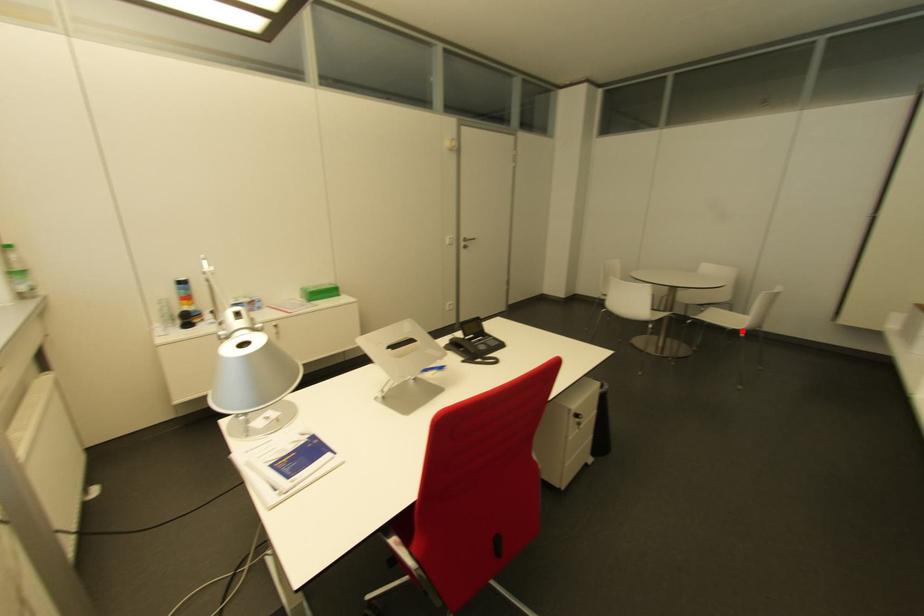
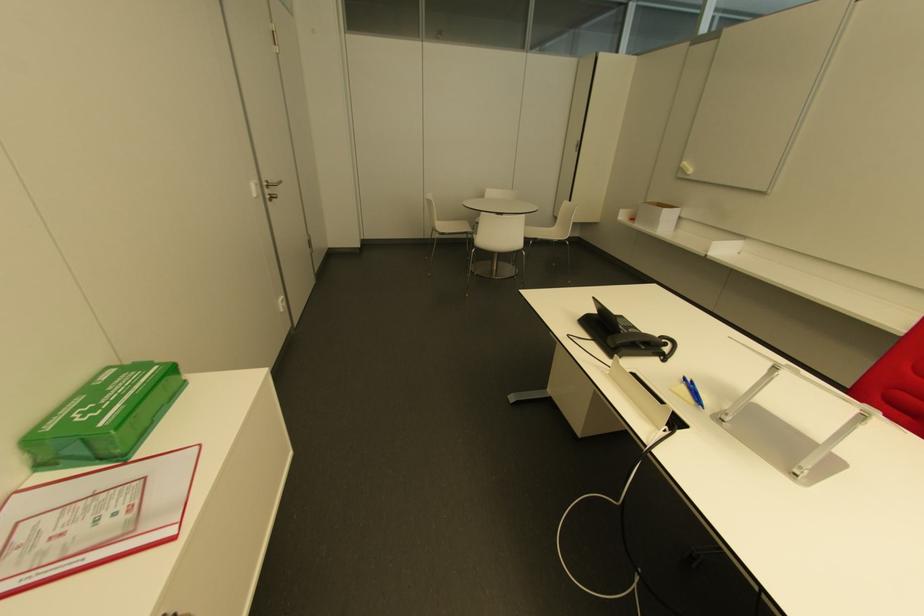
Question: I am providing you with two images of the same scene from different viewpoints. A red point is marked on the first image. At the location where the point appears in image 1, is it still visible in image 2?

Choices:
 (A) Yes
 (B) No

Answer: (A)